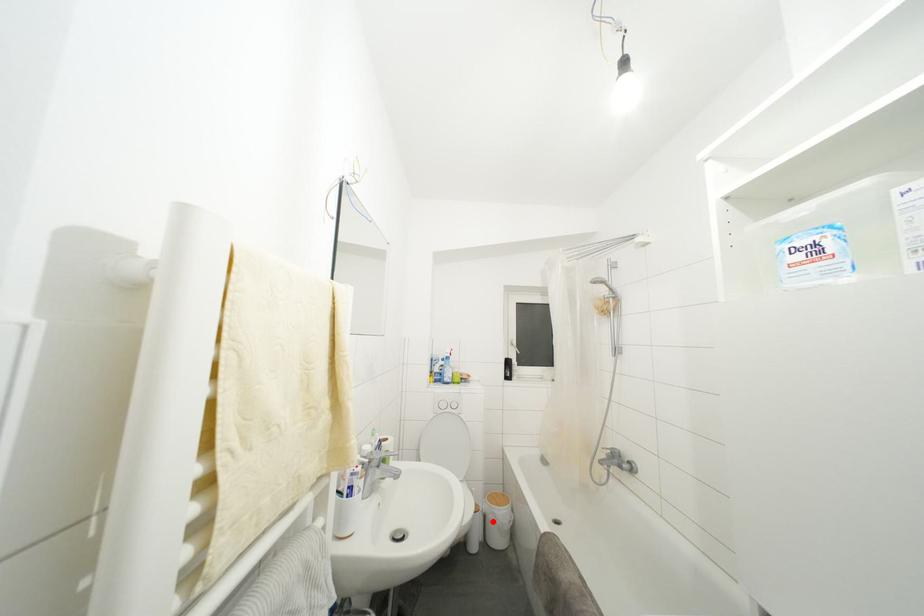
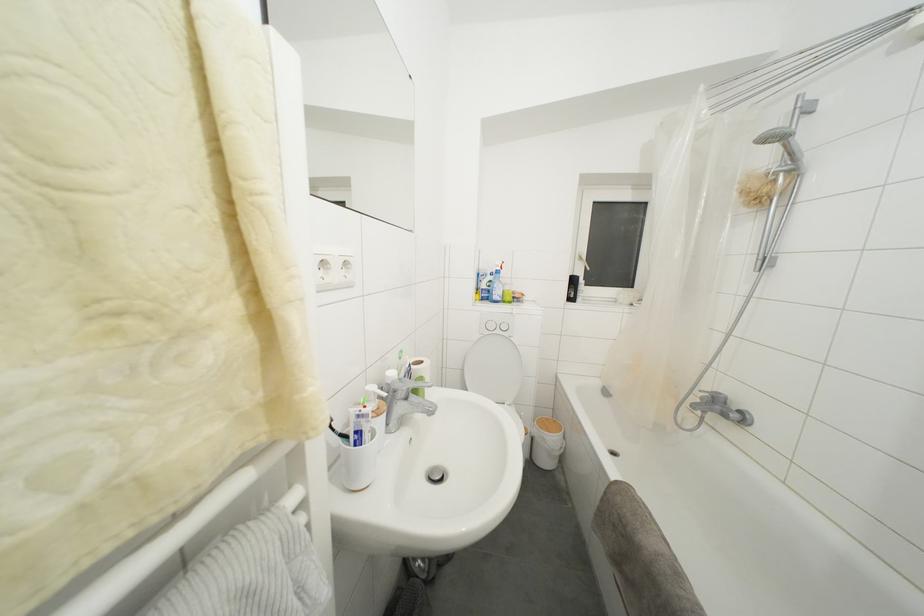
Find the pixel in the second image that matches the highlighted location in the first image.

(541, 445)